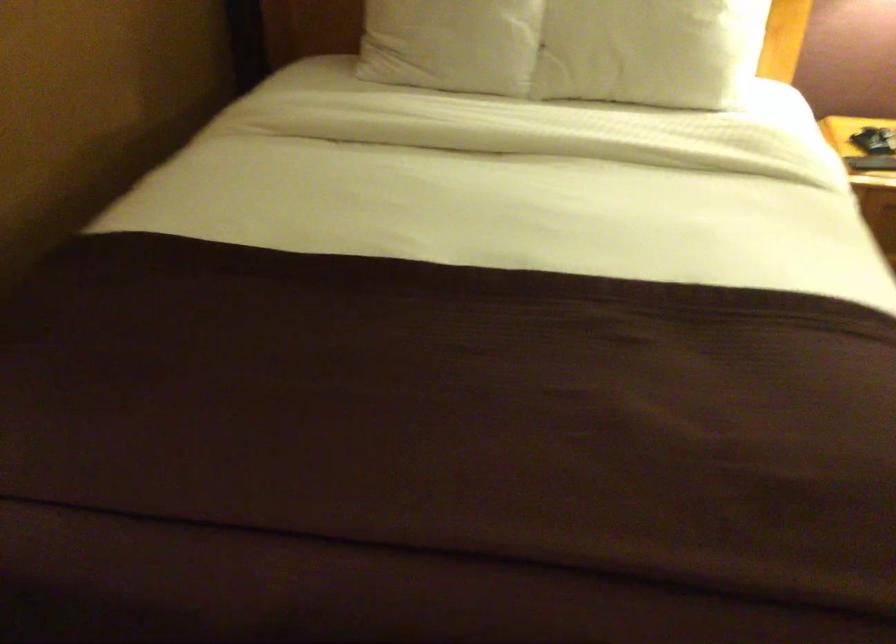
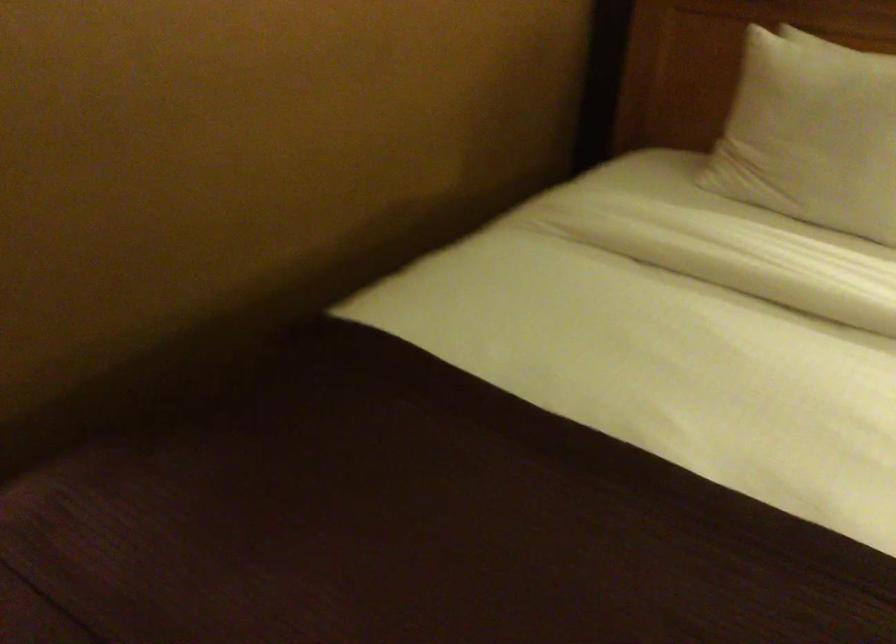
Question: The images are taken continuously from a first-person perspective. In which direction are you moving?

Choices:
 (A) Left
 (B) Right
 (C) Forward
 (D) Backward

Answer: (C)